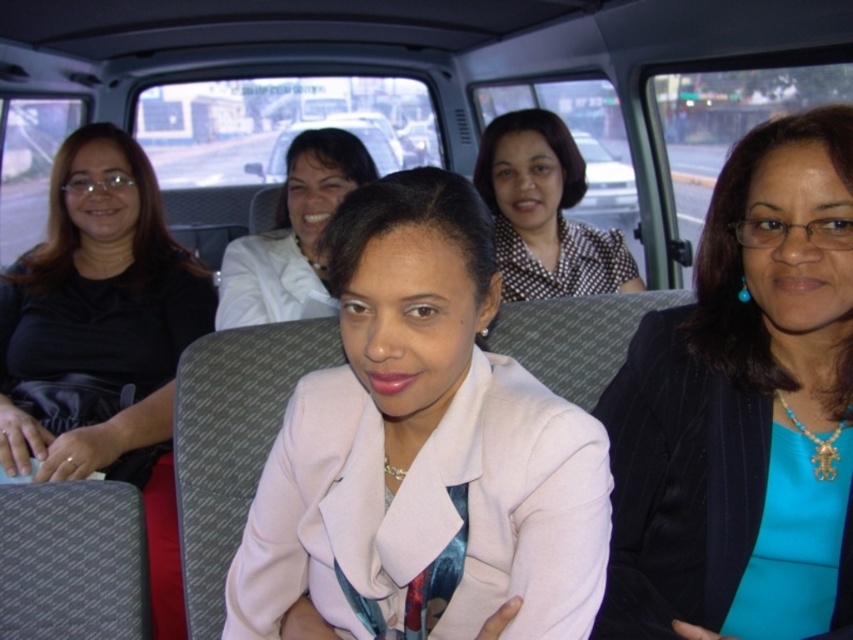
Question: Among these objects, which one is nearest to the camera?

Choices:
 (A) matte black blazer at right
 (B) matte white jacket at center

Answer: (A)

Question: Which object is the closest to the matte black blazer at right?

Choices:
 (A) white matte blazer at center
 (B) matte white car at center
 (C) polka dot blouse at center
 (D) black matte dress at left

Answer: (A)

Question: Can you confirm if black matte dress at left is thinner than matte white jacket at center?

Choices:
 (A) yes
 (B) no

Answer: (B)

Question: Does black matte dress at left have a larger size compared to polka dot blouse at center?

Choices:
 (A) no
 (B) yes

Answer: (B)

Question: Is matte black blazer at right smaller than matte white car at center?

Choices:
 (A) no
 (B) yes

Answer: (B)

Question: Which object is farther from the camera taking this photo?

Choices:
 (A) polka dot blouse at center
 (B) matte white jacket at center

Answer: (A)